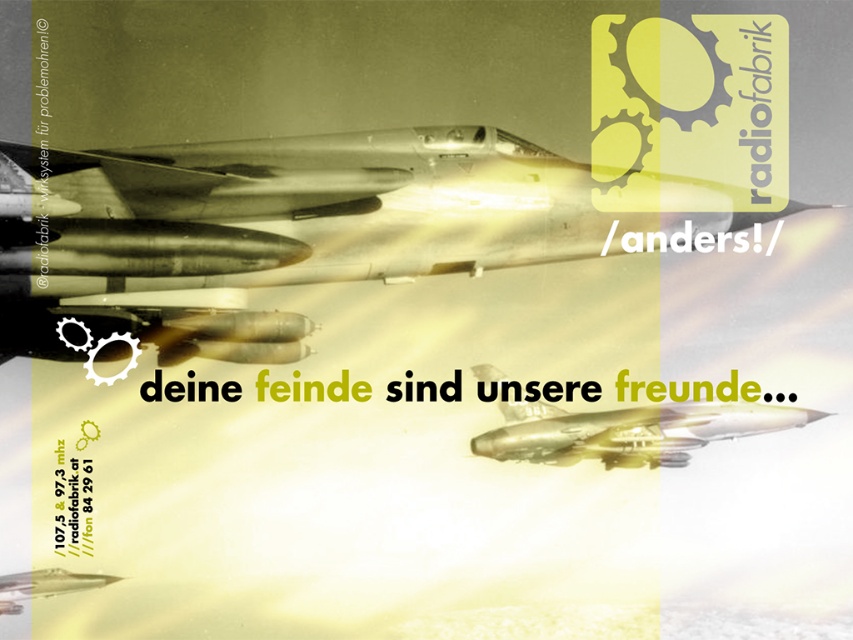
You are a military analyst assessing the image of two fighter jets. The scene shows a metallic silver plane at center and a metallic gold airplane at center. Which of these two fighter jets appears to be the larger one in the image?

The metallic silver plane at center is larger in size than the metallic gold airplane at center, so the metallic silver plane at center is the larger one.

What are the coordinates of the metallic silver plane at center?

The metallic silver plane at center is located at point (310, 216).